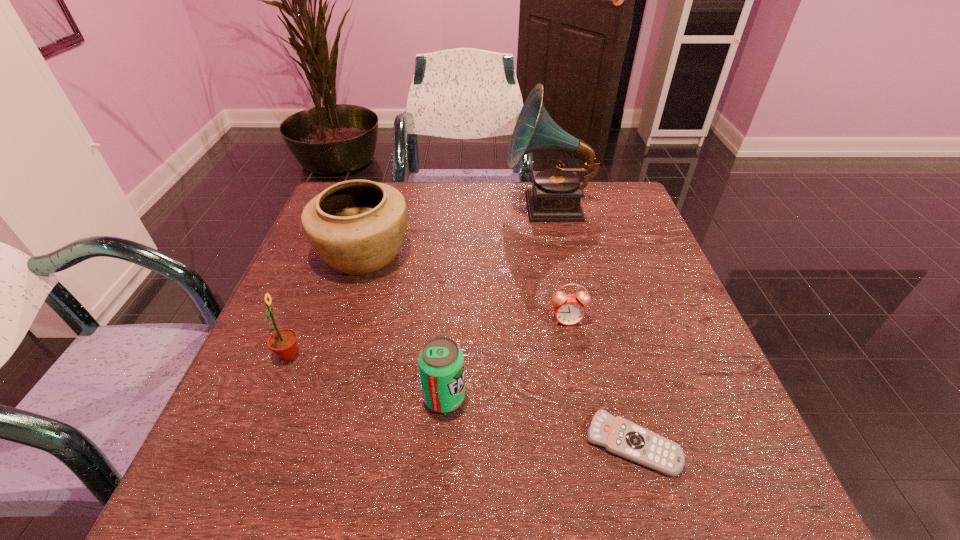
Find the location of a particular element. sunflower that is at the left edge is located at coordinates (283, 343).

This screenshot has height=540, width=960. In order to click on phonograph_record located in the right edge section of the desktop in this screenshot , I will do `click(556, 193)`.

Locate an element on the screen. The width and height of the screenshot is (960, 540). remote control located in the right edge section of the desktop is located at coordinates click(619, 436).

At what (x,y) coordinates should I click in order to perform the action: click on object at the far left corner. Please return your answer as a coordinate pair (x, y). Looking at the image, I should click on (357, 226).

What are the coordinates of `object that is positioned at the far right corner` in the screenshot? It's located at (556, 193).

Where is `object situated at the near right corner`? Image resolution: width=960 pixels, height=540 pixels. object situated at the near right corner is located at coordinates (619, 436).

At what (x,y) coordinates should I click in order to perform the action: click on vacant region at the far edge of the desktop. Please return your answer as a coordinate pair (x, y). Looking at the image, I should click on (492, 223).

The width and height of the screenshot is (960, 540). I want to click on free space at the near edge of the desktop, so click(445, 460).

Locate an element on the screen. This screenshot has height=540, width=960. vacant space at the left edge is located at coordinates (306, 370).

Find the location of a particular element. This screenshot has width=960, height=540. free space at the right edge of the desktop is located at coordinates (642, 326).